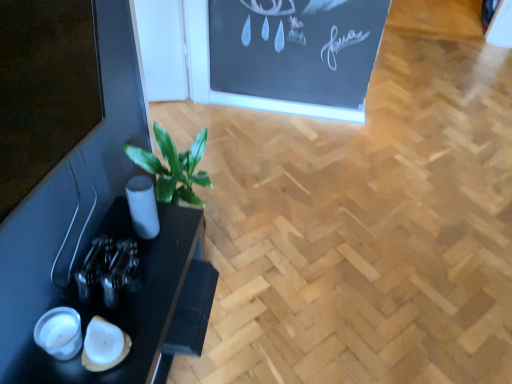
I want to click on free space above black glossy table at lower left (from a real-world perspective), so click(128, 288).